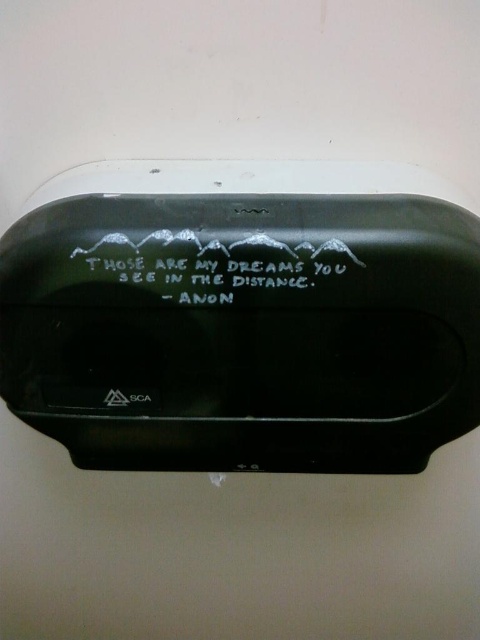
You are standing in front of the toilet paper dispenser described in the scene. There are two objects here, the matte black mirror at center and the white matte text at center. Which object is taller?

The matte black mirror at center is taller than the white matte text at center.

You are a painter who wants to hang a 3.5 inch wide painting between the matte black mirror at center and the white matte text at center. Can you fit it there without overlapping either object?

The distance between the matte black mirror at center and the white matte text at center is 4.02 inches. Since the painting is 3.5 inches wide, it can fit between them without overlapping as 3.5 is less than 4.02.